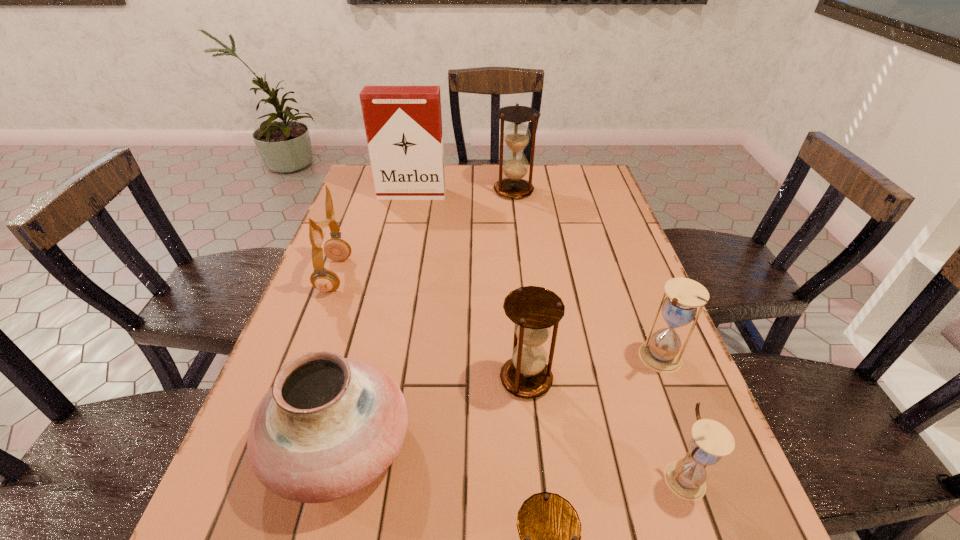
The image size is (960, 540). What are the coordinates of `cigarette_case situated at the left edge` in the screenshot? It's located at (403, 124).

Locate an element on the screen. This screenshot has height=540, width=960. earphone located in the left edge section of the desktop is located at coordinates (325, 280).

Where is `pottery that is at the left edge`? pottery that is at the left edge is located at coordinates (330, 426).

Locate an element on the screen. object present at the far left corner is located at coordinates (403, 124).

At what (x,y) coordinates should I click in order to perform the action: click on vacant space at the far edge of the desktop. Please return your answer as a coordinate pair (x, y). This screenshot has height=540, width=960. Looking at the image, I should click on (496, 195).

Image resolution: width=960 pixels, height=540 pixels. In the image, there is a desktop. What are the coordinates of `free space at the right edge` in the screenshot? It's located at (637, 416).

I want to click on vacant space at the far left corner of the desktop, so click(351, 189).

In order to click on free space at the far right corner in this screenshot , I will do `click(575, 194)`.

Find the location of a particular element. The width and height of the screenshot is (960, 540). unoccupied position between the farthest brown hourglass and the second nearest brown hourglass is located at coordinates click(520, 285).

Where is `free area in between the bigger white hourglass and the pottery`? Image resolution: width=960 pixels, height=540 pixels. free area in between the bigger white hourglass and the pottery is located at coordinates (500, 402).